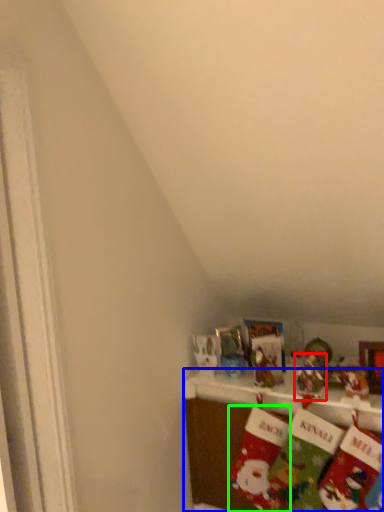
Question: Which object is positioned farthest from toy (highlighted by a red box)? Select from shelf (highlighted by a blue box) and sock (highlighted by a green box).

Choices:
 (A) shelf
 (B) sock

Answer: (A)